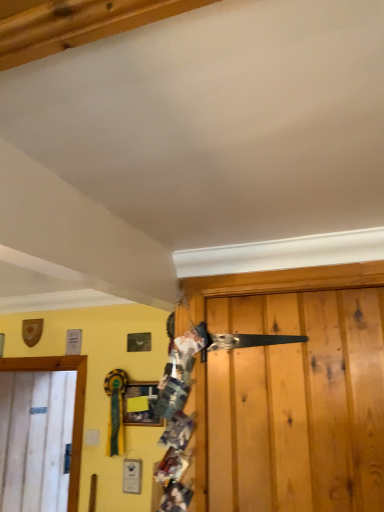
Question: Does matte wooden picture frame at center have a larger size compared to white wood door at left?

Choices:
 (A) yes
 (B) no

Answer: (B)

Question: Can you confirm if matte wooden picture frame at center is shorter than white wood door at left?

Choices:
 (A) no
 (B) yes

Answer: (B)

Question: From a real-world perspective, is matte wooden picture frame at center positioned under white wood door at left based on gravity?

Choices:
 (A) no
 (B) yes

Answer: (A)

Question: Could white wood door at left be considered to be inside matte wooden picture frame at center?

Choices:
 (A) yes
 (B) no

Answer: (B)

Question: Is matte wooden picture frame at center wider than white wood door at left?

Choices:
 (A) yes
 (B) no

Answer: (B)

Question: Relative to white wood door at left, is matte wooden picture frame at center in front or behind?

Choices:
 (A) behind
 (B) front

Answer: (B)

Question: Is matte wooden picture frame at center inside the boundaries of white wood door at left, or outside?

Choices:
 (A) inside
 (B) outside

Answer: (B)

Question: In the image, is matte wooden picture frame at center on the left side or the right side of white wood door at left?

Choices:
 (A) left
 (B) right

Answer: (B)

Question: From a real-world perspective, relative to white wood door at left, is matte wooden picture frame at center vertically above or below?

Choices:
 (A) above
 (B) below

Answer: (A)

Question: From a real-world perspective, is matte wooden picture frame at center physically located above or below multicolored fabric at center?

Choices:
 (A) below
 (B) above

Answer: (A)

Question: Is matte wooden picture frame at center wider or thinner than multicolored fabric at center?

Choices:
 (A) thin
 (B) wide

Answer: (A)

Question: Considering the positions of matte wooden picture frame at center and multicolored fabric at center in the image, is matte wooden picture frame at center taller or shorter than multicolored fabric at center?

Choices:
 (A) short
 (B) tall

Answer: (A)

Question: Is point (125, 398) closer or farther from the camera than point (168, 385)?

Choices:
 (A) farther
 (B) closer

Answer: (A)

Question: Is white wood door at left inside the boundaries of matte wooden picture frame at center, or outside?

Choices:
 (A) outside
 (B) inside

Answer: (A)

Question: Considering the positions of white wood door at left and matte wooden picture frame at center in the image, is white wood door at left wider or thinner than matte wooden picture frame at center?

Choices:
 (A) thin
 (B) wide

Answer: (B)